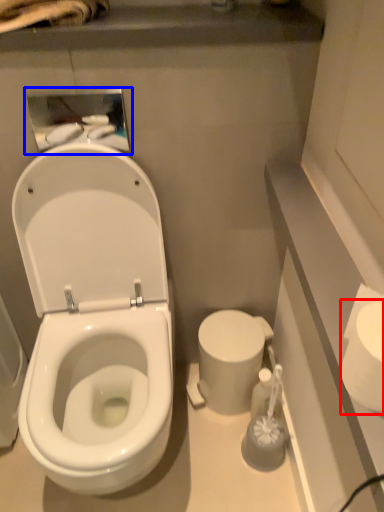
Question: Which object appears closest to the camera in this image, toilet paper (highlighted by a red box) or medicine cabinet (highlighted by a blue box)?

Choices:
 (A) toilet paper
 (B) medicine cabinet

Answer: (A)